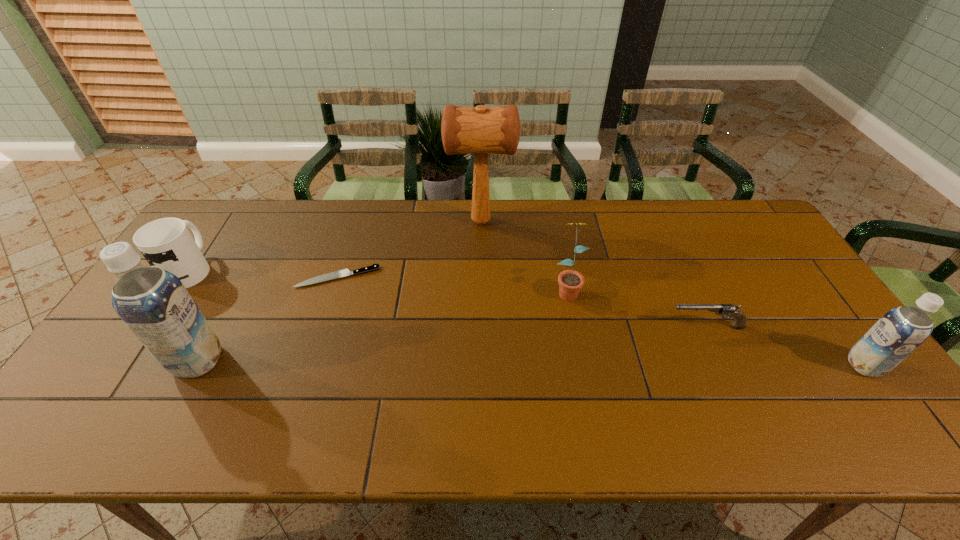
Where is `the left soya milk`? This screenshot has width=960, height=540. the left soya milk is located at coordinates (154, 304).

This screenshot has width=960, height=540. I want to click on the second object from left to right, so click(x=154, y=304).

Where is `the rightmost object`? The height and width of the screenshot is (540, 960). the rightmost object is located at coordinates (900, 331).

Locate an element on the screen. Image resolution: width=960 pixels, height=540 pixels. the right soya milk is located at coordinates (900, 331).

The image size is (960, 540). I want to click on the farthest object, so click(481, 130).

At what (x,y) coordinates should I click in order to perform the action: click on mallet. Please return your answer as a coordinate pair (x, y). Image resolution: width=960 pixels, height=540 pixels. Looking at the image, I should click on (481, 130).

Where is `steak knife`? steak knife is located at coordinates (345, 272).

Image resolution: width=960 pixels, height=540 pixels. Find the location of `the third object from left to right`. the third object from left to right is located at coordinates (345, 272).

Locate an element on the screen. The height and width of the screenshot is (540, 960). the third nearest object is located at coordinates (739, 322).

In order to click on the sixth object from left to right in this screenshot , I will do `click(739, 322)`.